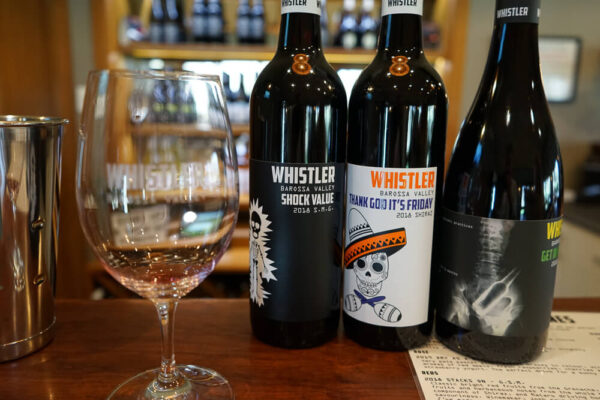
Find the location of a particular element. The height and width of the screenshot is (400, 600). wine glass is located at coordinates (159, 245).